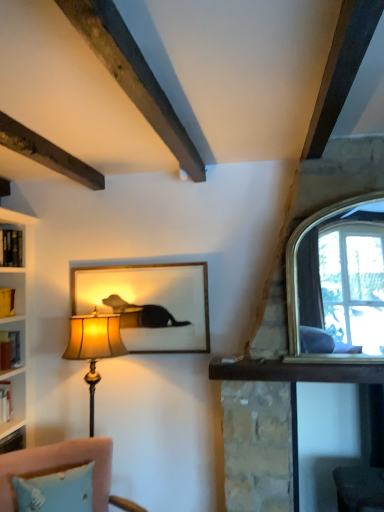
Locate an element on the screen. The image size is (384, 512). matte glass picture frame at center is located at coordinates (149, 304).

Locate an element on the screen. The image size is (384, 512). velvet pink sofa at lower left is located at coordinates (62, 469).

Locate an element on the screen. The height and width of the screenshot is (512, 384). clear glass window at upper right is located at coordinates (296, 260).

Considering the sizes of clear glass window at upper right and velvet pink sofa at lower left in the image, is clear glass window at upper right bigger or smaller than velvet pink sofa at lower left?

Clearly, clear glass window at upper right is smaller in size than velvet pink sofa at lower left.

Does clear glass window at upper right touch velvet pink sofa at lower left?

No, clear glass window at upper right is not with velvet pink sofa at lower left.

In order to click on furniture in front of the clear glass window at upper right in this screenshot , I will do `click(62, 469)`.

Which of these two, velvet pink sofa at lower left or matte gold lampshade at left, stands taller?

With more height is matte gold lampshade at left.

Between velvet pink sofa at lower left and matte gold lampshade at left, which one has smaller size?

With smaller size is matte gold lampshade at left.

Is velvet pink sofa at lower left directly adjacent to matte gold lampshade at left?

No.

From the image's perspective, would you say velvet pink sofa at lower left is shown under matte gold lampshade at left?

Yes, from the image's perspective, velvet pink sofa at lower left is below matte gold lampshade at left.

What are the coordinates of `book on the left of the clear glass window at upper right` in the screenshot? It's located at (9, 349).

Would you say clear glass window at upper right is a long distance from hardcover book at left?

Yes, clear glass window at upper right and hardcover book at left are located far from each other.

From a real-world perspective, between matte gold lampshade at left and clear glass window at upper right, who is vertically lower?

From a 3D spatial view, matte gold lampshade at left is below.

How far apart are matte gold lampshade at left and clear glass window at upper right?

3.60 feet.

Which point is more distant from viewer, (90, 393) or (374, 195)?

The point (90, 393) is farther.

Who is bigger, matte gold lampshade at left or clear glass window at upper right?

With larger size is matte gold lampshade at left.

Measure the distance from matte glass picture frame at center to clear glass window at upper right.

matte glass picture frame at center is 35.27 inches from clear glass window at upper right.

Does matte glass picture frame at center have a greater width compared to clear glass window at upper right?

Incorrect, the width of matte glass picture frame at center does not surpass that of clear glass window at upper right.

Which object is closer to the camera taking this photo, matte glass picture frame at center or clear glass window at upper right?

Positioned in front is clear glass window at upper right.

Is matte glass picture frame at center not near clear glass window at upper right?

Actually, matte glass picture frame at center and clear glass window at upper right are a little close together.

Is matte glass picture frame at center positioned far away from velvet pink sofa at lower left?

They are positioned close to each other.

Between matte glass picture frame at center and velvet pink sofa at lower left, which one appears on the left side from the viewer's perspective?

velvet pink sofa at lower left.

In the scene shown: Does matte glass picture frame at center have a smaller size compared to velvet pink sofa at lower left?

Yes.

What's the angular difference between matte glass picture frame at center and velvet pink sofa at lower left's facing directions?

There is a 39-degree angle between the facing directions of matte glass picture frame at center and velvet pink sofa at lower left.

From a real-world perspective, is clear glass window at upper right positioned under matte gold lampshade at left based on gravity?

No, from a real-world perspective, clear glass window at upper right is not beneath matte gold lampshade at left.

Considering the sizes of objects clear glass window at upper right and matte gold lampshade at left in the image provided, who is shorter, clear glass window at upper right or matte gold lampshade at left?

With less height is clear glass window at upper right.

Based on their sizes in the image, would you say clear glass window at upper right is bigger or smaller than matte gold lampshade at left?

Considering their sizes, clear glass window at upper right takes up less space than matte gold lampshade at left.

This screenshot has height=512, width=384. In order to click on furniture on the left of clear glass window at upper right in this screenshot , I will do `click(62, 469)`.

Identify the location of lamp located on the right of velvet pink sofa at lower left. Image resolution: width=384 pixels, height=512 pixels. (94, 346).

Based on their spatial positions, is clear glass window at upper right or hardcover book at left closer to velvet pink sofa at lower left?

Based on the image, hardcover book at left appears to be nearer to velvet pink sofa at lower left.

Which object lies nearer to the anchor point clear glass window at upper right, hardcover book at left or velvet pink sofa at lower left?

Among the two, velvet pink sofa at lower left is located nearer to clear glass window at upper right.

Based on their spatial positions, is matte gold lampshade at left or hardcover book at left closer to velvet pink sofa at lower left?

The object closer to velvet pink sofa at lower left is matte gold lampshade at left.

When comparing their distances from matte glass picture frame at center, does hardcover book at left or velvet pink sofa at lower left seem further?

velvet pink sofa at lower left.

Estimate the real-world distances between objects in this image. Which object is closer to clear glass window at upper right, velvet pink sofa at lower left or matte glass picture frame at center?

matte glass picture frame at center lies closer to clear glass window at upper right than the other object.

Estimate the real-world distances between objects in this image. Which object is closer to hardcover book at left, matte gold lampshade at left or velvet pink sofa at lower left?

matte gold lampshade at left lies closer to hardcover book at left than the other object.

Estimate the real-world distances between objects in this image. Which object is further from hardcover book at left, matte glass picture frame at center or matte gold lampshade at left?

The object further to hardcover book at left is matte glass picture frame at center.

From the image, which object appears to be farther from matte glass picture frame at center, matte gold lampshade at left or hardcover book at left?

Among the two, hardcover book at left is located further to matte glass picture frame at center.

In order to click on lamp located between velvet pink sofa at lower left and hardcover book at left in the depth direction in this screenshot , I will do `click(94, 346)`.

Where is `furniture located between hardcover book at left and clear glass window at upper right in the left-right direction`? The width and height of the screenshot is (384, 512). furniture located between hardcover book at left and clear glass window at upper right in the left-right direction is located at coordinates (62, 469).

The height and width of the screenshot is (512, 384). Find the location of `picture frame between hardcover book at left and clear glass window at upper right from left to right`. picture frame between hardcover book at left and clear glass window at upper right from left to right is located at coordinates (149, 304).

This screenshot has width=384, height=512. Find the location of `lamp between hardcover book at left and matte glass picture frame at center`. lamp between hardcover book at left and matte glass picture frame at center is located at coordinates (94, 346).